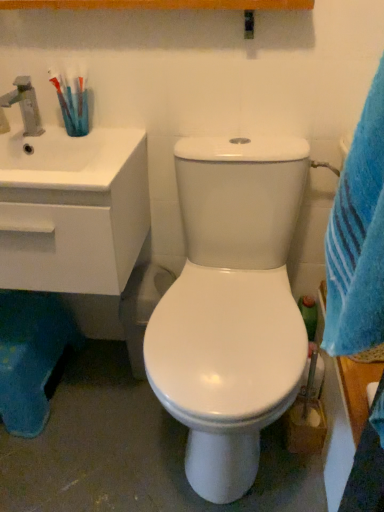
Question: Can you confirm if white glossy sink at left is shorter than blue plush rug at lower left?

Choices:
 (A) yes
 (B) no

Answer: (B)

Question: Is white glossy sink at left positioned behind blue plush rug at lower left?

Choices:
 (A) yes
 (B) no

Answer: (B)

Question: From the image's perspective, is white glossy sink at left over blue plush rug at lower left?

Choices:
 (A) no
 (B) yes

Answer: (B)

Question: From a real-world perspective, is white glossy sink at left located beneath blue plush rug at lower left?

Choices:
 (A) yes
 (B) no

Answer: (B)

Question: Considering the relative sizes of white glossy sink at left and blue plush rug at lower left in the image provided, is white glossy sink at left smaller than blue plush rug at lower left?

Choices:
 (A) no
 (B) yes

Answer: (A)

Question: Is translucent plastic toothbrush at upper left taller or shorter than blue plush rug at lower left?

Choices:
 (A) short
 (B) tall

Answer: (A)

Question: In the image, is translucent plastic toothbrush at upper left positioned in front of or behind blue plush rug at lower left?

Choices:
 (A) behind
 (B) front

Answer: (B)

Question: Based on their positions, is translucent plastic toothbrush at upper left located to the left or right of blue plush rug at lower left?

Choices:
 (A) left
 (B) right

Answer: (B)

Question: From the image's perspective, is translucent plastic toothbrush at upper left located above or below blue plush rug at lower left?

Choices:
 (A) above
 (B) below

Answer: (A)

Question: Is blue plush rug at lower left bigger or smaller than translucent plastic toothbrush at upper left?

Choices:
 (A) big
 (B) small

Answer: (A)

Question: Is blue plush rug at lower left situated inside translucent plastic toothbrush at upper left or outside?

Choices:
 (A) outside
 (B) inside

Answer: (A)

Question: In terms of height, does blue plush rug at lower left look taller or shorter compared to translucent plastic toothbrush at upper left?

Choices:
 (A) tall
 (B) short

Answer: (A)

Question: From the image's perspective, is blue plush rug at lower left above or below translucent plastic toothbrush at upper left?

Choices:
 (A) below
 (B) above

Answer: (A)

Question: From a real-world perspective, relative to blue plush rug at lower left, is matte silver faucet at upper left vertically above or below?

Choices:
 (A) above
 (B) below

Answer: (A)

Question: Is matte silver faucet at upper left spatially inside blue plush rug at lower left, or outside of it?

Choices:
 (A) inside
 (B) outside

Answer: (B)